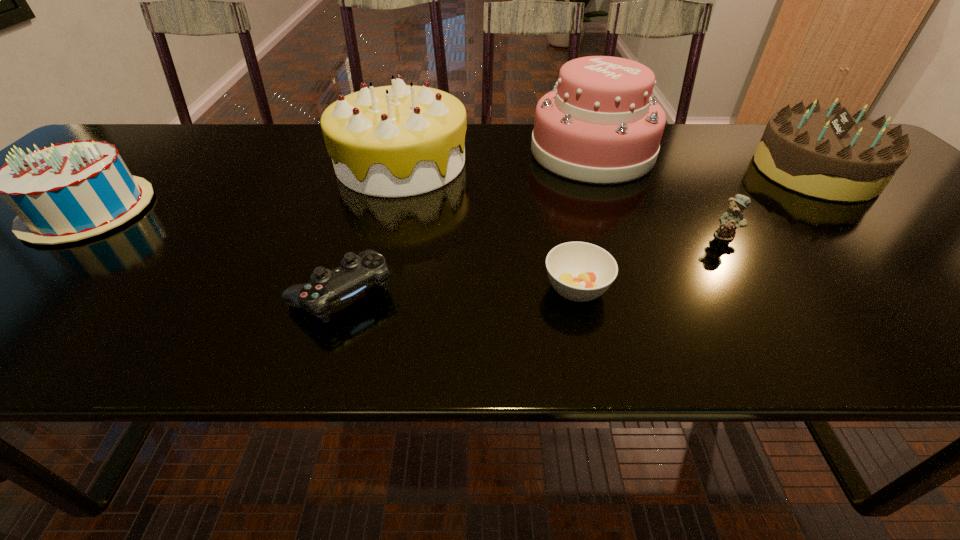
At what (x,y) coordinates should I click in order to perform the action: click on vacant space located 0.340m on the front-facing side of the rightmost object. Please return your answer as a coordinate pair (x, y). This screenshot has height=540, width=960. Looking at the image, I should click on (621, 171).

Where is `free location located 0.300m on the front-facing side of the rightmost object`? This screenshot has width=960, height=540. free location located 0.300m on the front-facing side of the rightmost object is located at coordinates (x=637, y=171).

This screenshot has width=960, height=540. Identify the location of vacant space located on the front-facing side of the teddy bear. (788, 334).

Find the location of a particular element. This screenshot has width=960, height=540. blank space located on the back of the second shortest object is located at coordinates (362, 228).

Find the location of a particular element. Image resolution: width=960 pixels, height=540 pixels. vacant space located 0.400m on the back of the soup bowl is located at coordinates (548, 161).

Find the location of a particular element. This screenshot has height=540, width=960. cake that is at the far edge is located at coordinates (600, 124).

Identify the location of object present at the near edge. This screenshot has width=960, height=540. (357, 273).

In order to click on object that is at the right edge in this screenshot , I will do `click(831, 154)`.

Image resolution: width=960 pixels, height=540 pixels. I want to click on object that is at the far right corner, so click(x=831, y=154).

At what (x,y) coordinates should I click in order to perform the action: click on vacant area at the far edge. Please return your answer as a coordinate pair (x, y). Looking at the image, I should click on (297, 154).